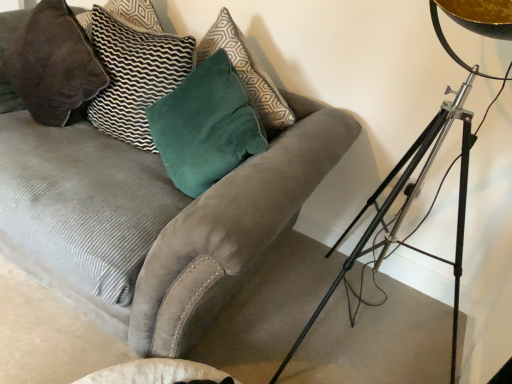
Question: Is metallic tripod at right located outside velvet green pillow at upper left, the first pillow from the right?

Choices:
 (A) yes
 (B) no

Answer: (A)

Question: Does metallic tripod at right have a lesser height compared to velvet green pillow at upper left, the first pillow from the right?

Choices:
 (A) no
 (B) yes

Answer: (A)

Question: From the image's perspective, would you say metallic tripod at right is positioned over velvet green pillow at upper left, the first pillow from the right?

Choices:
 (A) yes
 (B) no

Answer: (B)

Question: Can you confirm if metallic tripod at right is bigger than velvet green pillow at upper left, the first pillow from the right?

Choices:
 (A) yes
 (B) no

Answer: (A)

Question: Does metallic tripod at right have a smaller size compared to velvet green pillow at upper left, the first pillow from the right?

Choices:
 (A) yes
 (B) no

Answer: (B)

Question: Are metallic tripod at right and velvet green pillow at upper left, the second pillow positioned from the left, located far from each other?

Choices:
 (A) no
 (B) yes

Answer: (B)

Question: Is velvet dark brown pillow at upper left, positioned as the 1th pillow in left-to-right order, located within velvet gray couch at center?

Choices:
 (A) yes
 (B) no

Answer: (A)

Question: Would you say velvet gray couch at center is a long distance from velvet dark brown pillow at upper left, the second pillow from the right?

Choices:
 (A) yes
 (B) no

Answer: (B)

Question: Are velvet gray couch at center and velvet dark brown pillow at upper left, the second pillow from the right, beside each other?

Choices:
 (A) no
 (B) yes

Answer: (A)

Question: Is velvet gray couch at center located outside velvet dark brown pillow at upper left, positioned as the 1th pillow in left-to-right order?

Choices:
 (A) yes
 (B) no

Answer: (A)

Question: Can you confirm if velvet gray couch at center is shorter than velvet dark brown pillow at upper left, the second pillow from the right?

Choices:
 (A) no
 (B) yes

Answer: (A)

Question: Is velvet gray couch at center facing towards velvet dark brown pillow at upper left, positioned as the 1th pillow in left-to-right order?

Choices:
 (A) no
 (B) yes

Answer: (A)

Question: Can you confirm if velvet dark brown pillow at upper left, positioned as the 1th pillow in left-to-right order, is positioned to the left of velvet gray couch at center?

Choices:
 (A) no
 (B) yes

Answer: (B)